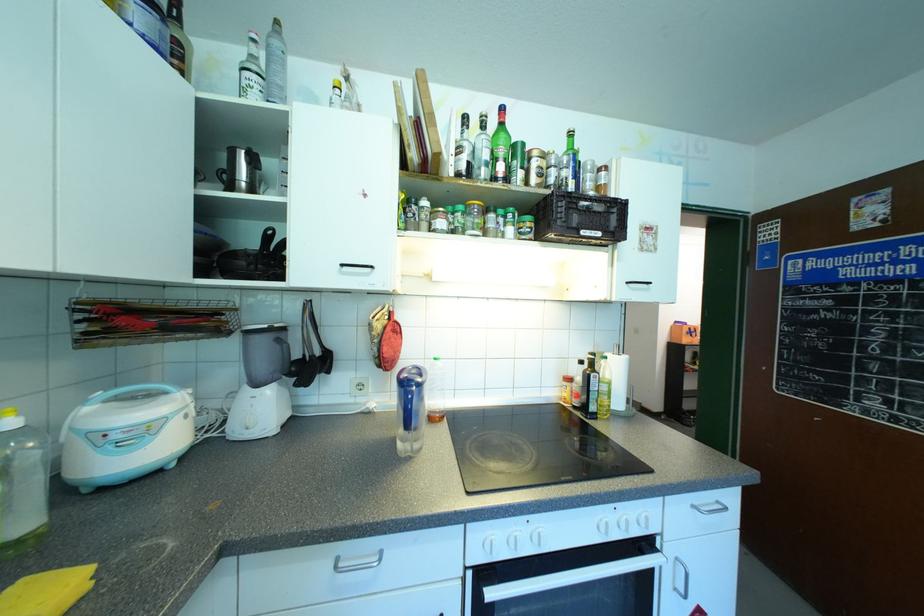
Where would you grasp the blue pitcher handle? Please return your answer as a coordinate pair (x, y).

(409, 410)